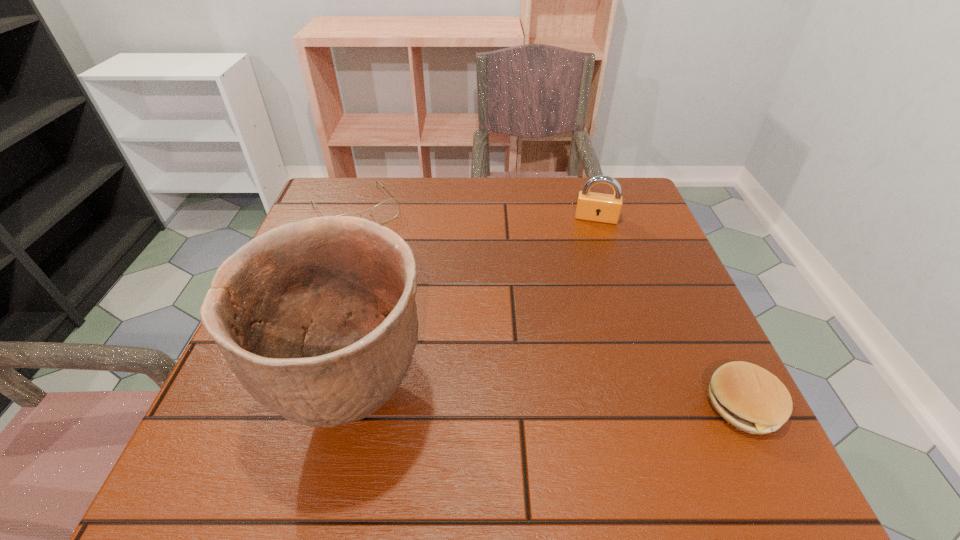
Identify the location of free spot on the desktop that is between the tallest object and the patty and is positioned to unlock the second object from right to left from the front. (582, 402).

Identify the location of free space on the desktop that is between the tallest object and the patty and is positioned on the front-facing side of the spectacles. Image resolution: width=960 pixels, height=540 pixels. (497, 400).